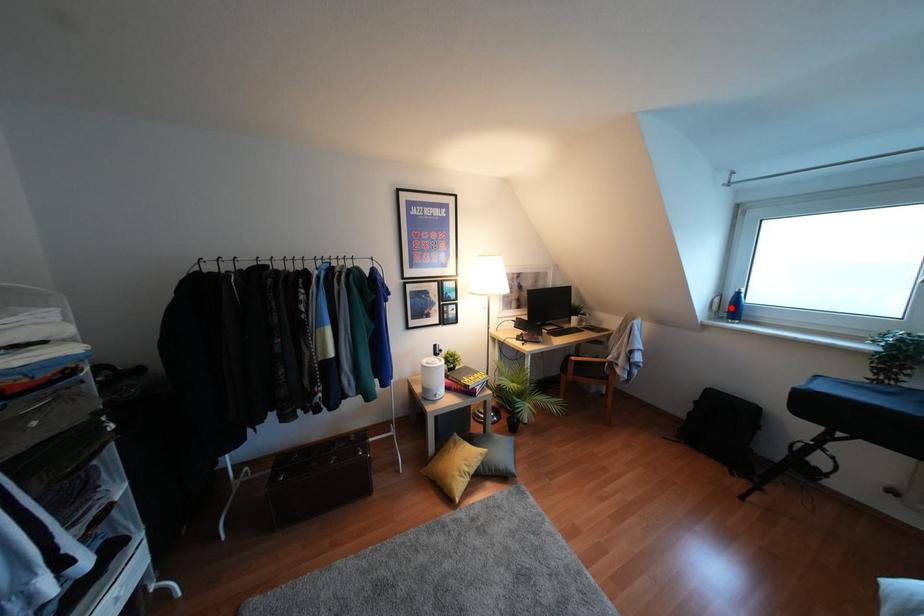
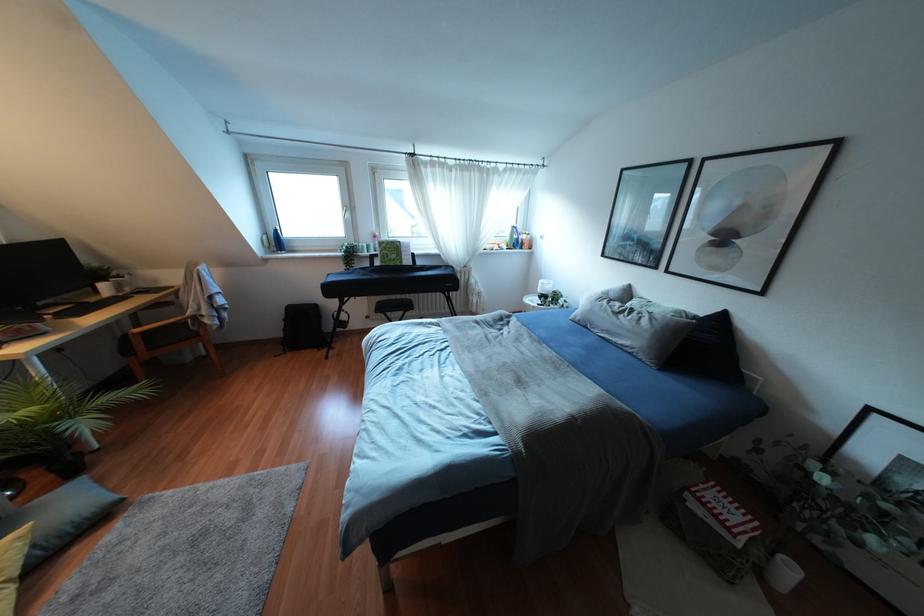
Locate, in the second image, the point that corresponds to the highlighted location in the first image.

(275, 241)